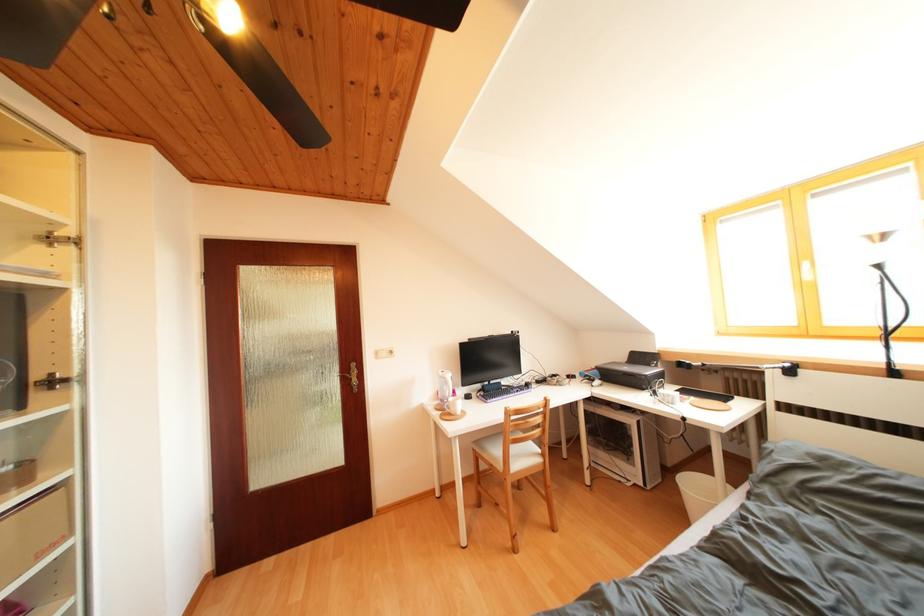
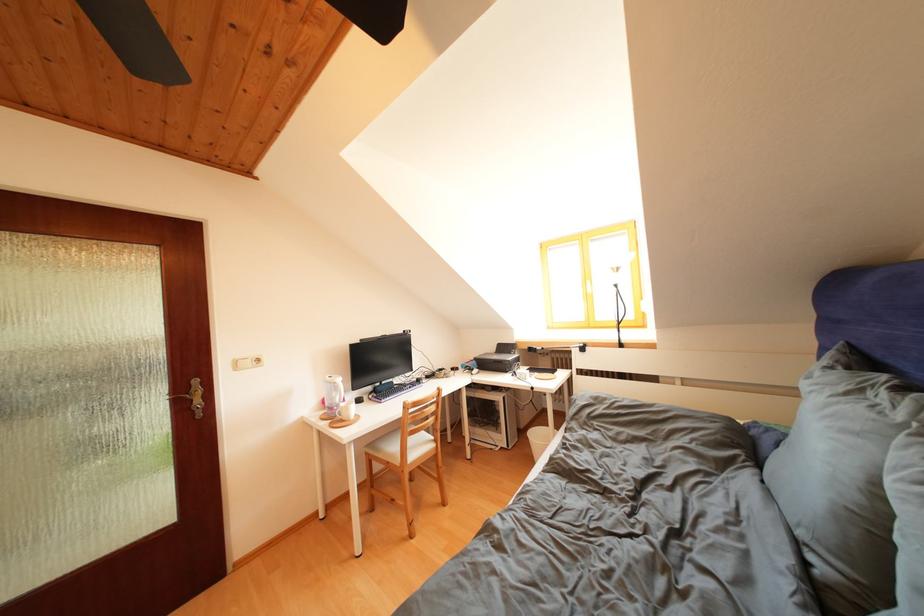
In the second image, find the point that corresponds to point 384,359 in the first image.

(244, 369)